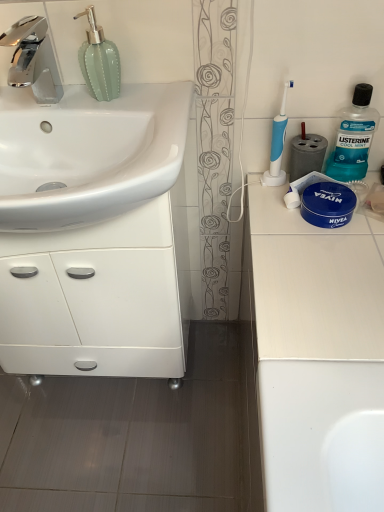
Find the location of `blank space to the left of green glass soap dispenser at upper left`. blank space to the left of green glass soap dispenser at upper left is located at coordinates coord(51,101).